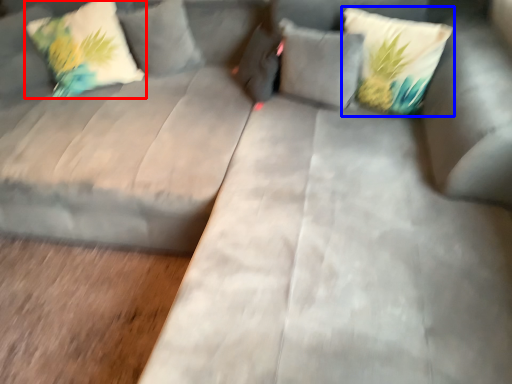
Question: Which of the following is the closest to the observer, pillow (highlighted by a red box) or pillow (highlighted by a blue box)?

Choices:
 (A) pillow
 (B) pillow

Answer: (B)